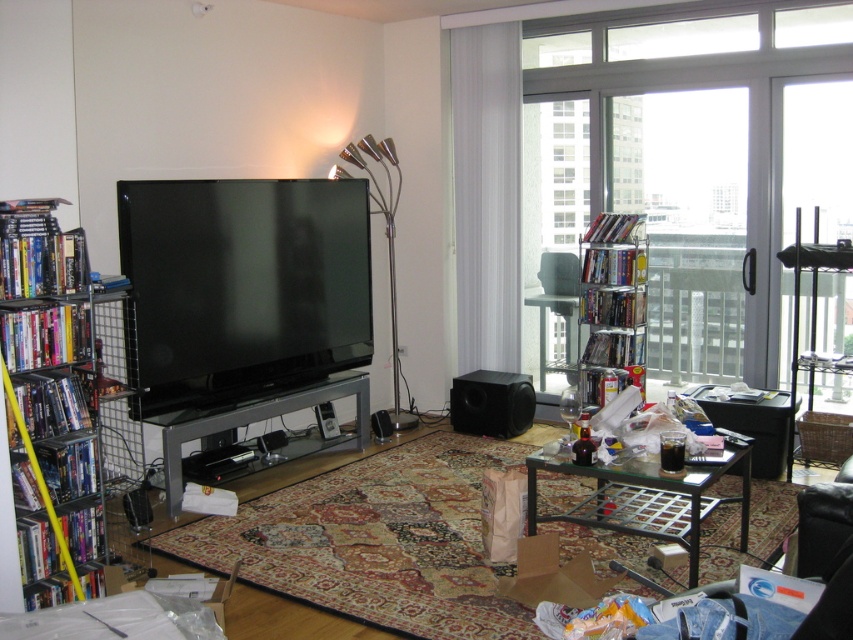
Which is above, metallic wire bookshelf at left or metal/glass entertainment center at center?

metallic wire bookshelf at left is higher up.

Between point (84, 253) and point (167, 449), which one is positioned in front?

Positioned in front is point (84, 253).

Where is `metallic wire bookshelf at left`? The image size is (853, 640). metallic wire bookshelf at left is located at coordinates (54, 369).

Can you confirm if transparent glass door at upper right is positioned to the left of metallic wire bookshelf at left?

Incorrect, transparent glass door at upper right is not on the left side of metallic wire bookshelf at left.

Between point (642, 192) and point (15, 253), which one is positioned behind?

Positioned behind is point (642, 192).

Where is `transparent glass door at upper right`? The width and height of the screenshot is (853, 640). transparent glass door at upper right is located at coordinates (695, 161).

Can you confirm if black glossy flat screen tv at center is taller than metallic wire bookshelf at left?

No, black glossy flat screen tv at center is not taller than metallic wire bookshelf at left.

Is point (317, 355) positioned behind point (53, 557)?

Yes, it is.

Find the location of a particular element. The image size is (853, 640). black glossy flat screen tv at center is located at coordinates (241, 289).